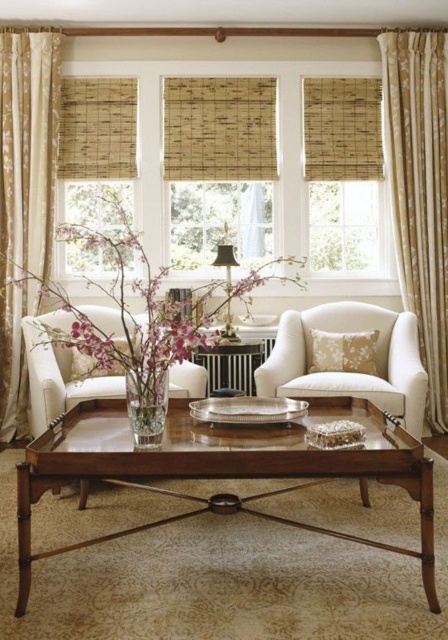
Describe the element at coordinates (250, 196) in the screenshot. I see `bamboo blinds at center` at that location.

Which is above, bamboo blinds at center or bamboo blind at center?

bamboo blind at center is above.

Looking at this image, who is more distant from viewer, (145, 237) or (223, 106)?

Point (145, 237)

Locate an element on the screen. The width and height of the screenshot is (448, 640). bamboo blinds at center is located at coordinates (250, 196).

Which is in front, point (192, 296) or point (214, 390)?

Point (214, 390)

Identify the location of clear glass vase at center. (145, 307).

Which is below, beige textured curtain at left or clear glass vase at center?

clear glass vase at center

Does beige textured curtain at left have a greater width compared to clear glass vase at center?

No.

Where is `beige textured curtain at left`? beige textured curtain at left is located at coordinates (25, 198).

The width and height of the screenshot is (448, 640). I want to click on beige textured curtain at left, so tap(25, 198).